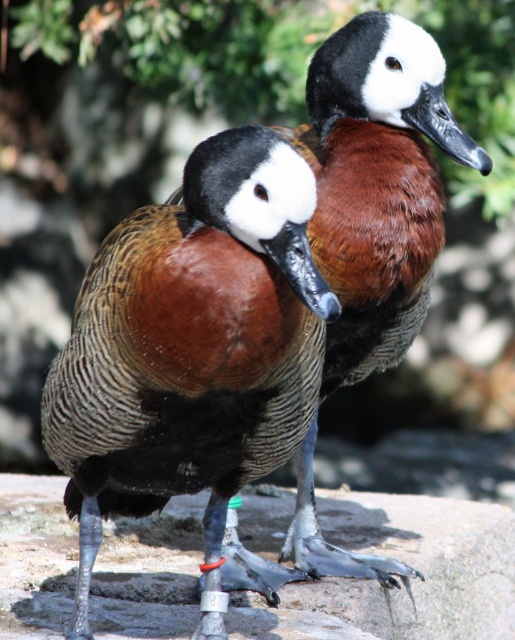
Question: Does gray stone at center have a lesser width compared to brown feathered duck at center?

Choices:
 (A) no
 (B) yes

Answer: (A)

Question: Which point is farther to the camera?

Choices:
 (A) brown feathered duck at center
 (B) gray stone at center

Answer: (B)

Question: Does gray stone at center have a lesser width compared to brown feathered duck at center?

Choices:
 (A) yes
 (B) no

Answer: (B)

Question: Which object appears closest to the camera in this image?

Choices:
 (A) brown speckled duck at center
 (B) brown feathered duck at center

Answer: (A)

Question: Which of these objects is positioned closest to the brown speckled duck at center?

Choices:
 (A) brown feathered duck at center
 (B) gray stone at center

Answer: (A)

Question: Does brown speckled duck at center have a larger size compared to brown feathered duck at center?

Choices:
 (A) yes
 (B) no

Answer: (B)